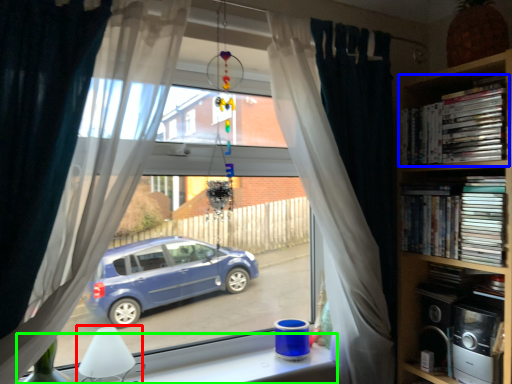
Question: Based on their relative distances, which object is nearer to lamp (highlighted by a red box)? Choose from book (highlighted by a blue box) and window (highlighted by a green box).

Choices:
 (A) book
 (B) window

Answer: (B)